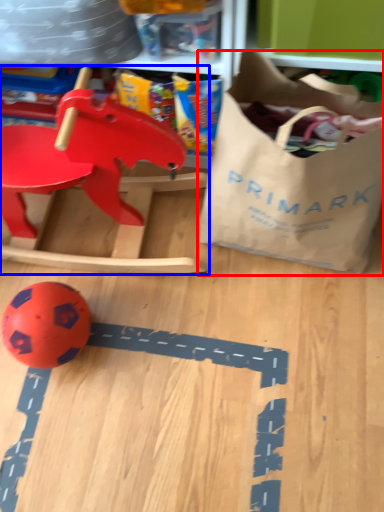
Question: Which of the following is the closest to the observer, grocery bag (highlighted by a red box) or toy (highlighted by a blue box)?

Choices:
 (A) grocery bag
 (B) toy

Answer: (A)